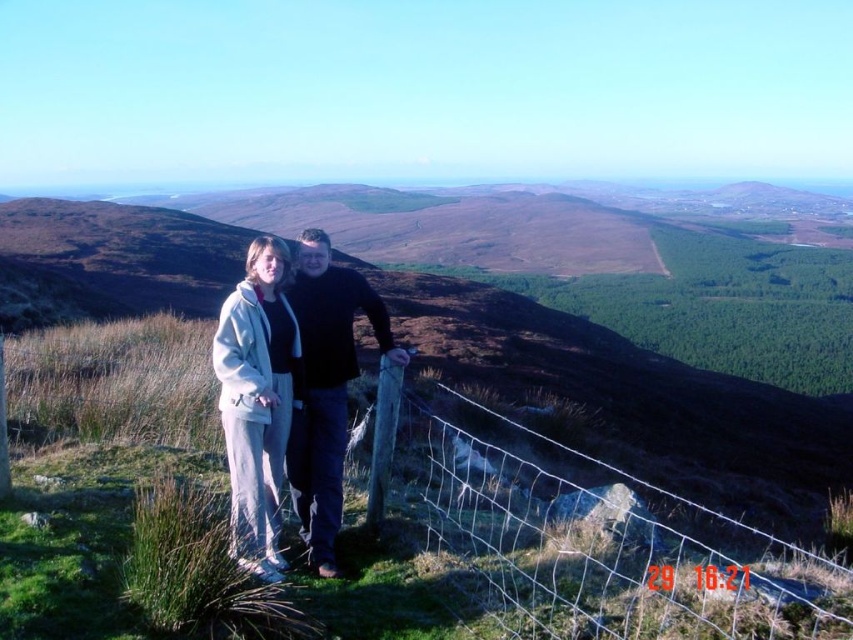
Question: Which object is positioned closest to the wire mesh fence at center?

Choices:
 (A) black matte jacket at center
 (B) white fleece jacket at center

Answer: (A)

Question: Among these points, which one is nearest to the camera?

Choices:
 (A) (260, 243)
 (B) (386, 324)
 (C) (583, 636)

Answer: (C)

Question: Is wire mesh fence at center smaller than black matte jacket at center?

Choices:
 (A) yes
 (B) no

Answer: (B)

Question: Can you confirm if wire mesh fence at center is thinner than black matte jacket at center?

Choices:
 (A) no
 (B) yes

Answer: (A)

Question: Where is wire mesh fence at center located in relation to white fleece jacket at center in the image?

Choices:
 (A) right
 (B) left

Answer: (A)

Question: Which point is farther from the camera taking this photo?

Choices:
 (A) (355, 301)
 (B) (292, 317)
 (C) (695, 579)

Answer: (A)